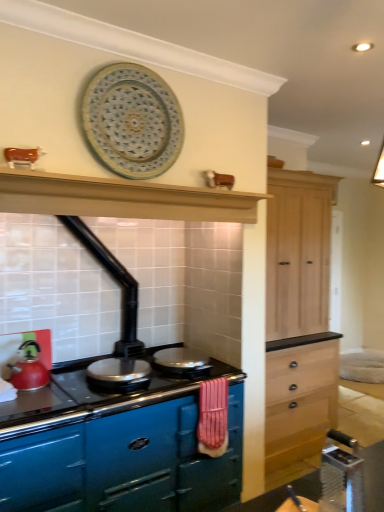
Where is `free point above blue ceramic platter at upper center (from a real-world perspective)`? The image size is (384, 512). free point above blue ceramic platter at upper center (from a real-world perspective) is located at coordinates (135, 67).